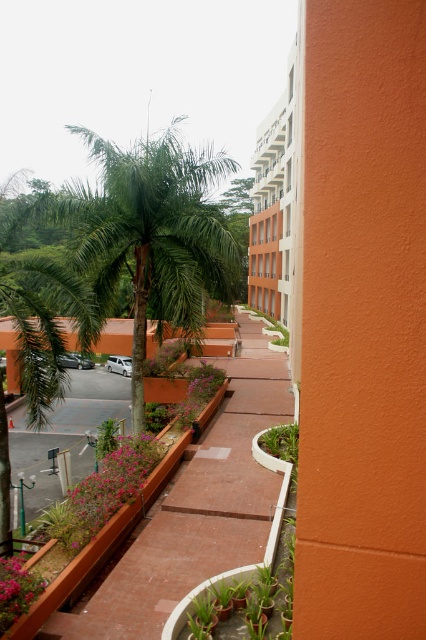
You are standing on the balcony looking at the green leafy palm tree at center and the pink matte flowers at lower left. Which object is taller?

The green leafy palm tree at center is taller than the pink matte flowers at lower left.

You are standing on a balcony looking at the scene. You see a point marked at coordinates (152, 236). What object is located at that point?

The point at coordinates (152, 236) indicates a green leafy palm tree at center.

Consider the image. You are standing on the balcony and want to know how far the point at coordinates (186, 524) is from you. Can you determine the distance?

The point at coordinates (186, 524) is 28.12 feet away from the viewer.